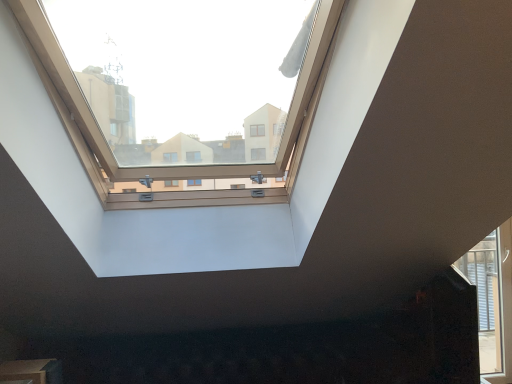
Image resolution: width=512 pixels, height=384 pixels. What do you see at coordinates (32, 371) in the screenshot?
I see `matte wood table at lower left` at bounding box center [32, 371].

Identify the location of matte wood table at lower left. The height and width of the screenshot is (384, 512). (32, 371).

In order to face matte wood table at lower left, should I rotate leftwards or rightwards?

Turn left by 27.913 degrees to look at matte wood table at lower left.

The height and width of the screenshot is (384, 512). In order to click on matte wood table at lower left in this screenshot , I will do `click(32, 371)`.